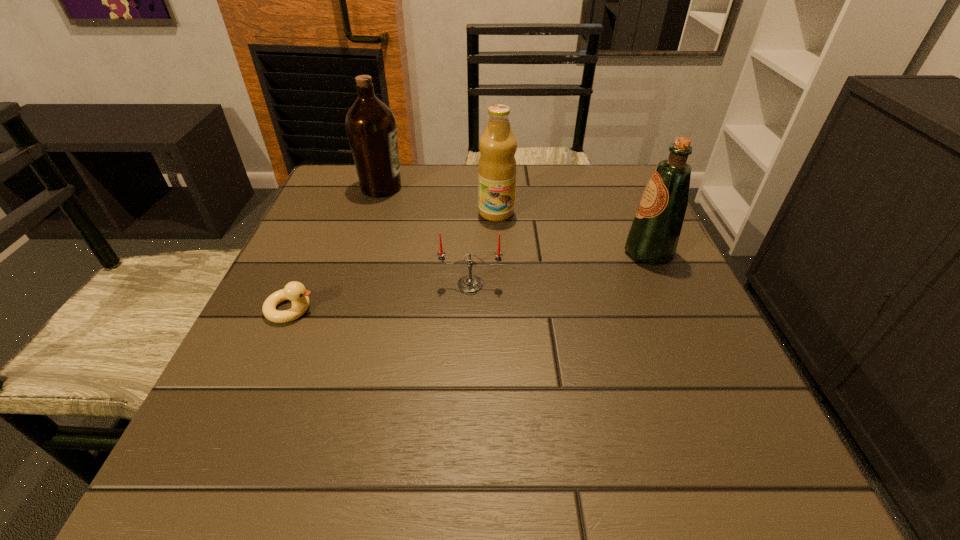
Where is `vacant point located between the leftmost olive oil and the nearest object`? vacant point located between the leftmost olive oil and the nearest object is located at coordinates (336, 248).

Identify the location of free space between the fourth farthest object and the farthest object. The height and width of the screenshot is (540, 960). (426, 236).

Find the location of a particular element. This screenshot has width=960, height=540. free space between the nearest object and the second olive oil from right to left is located at coordinates (394, 261).

The height and width of the screenshot is (540, 960). In order to click on free space between the farthest olive oil and the second farthest object in this screenshot , I will do `click(439, 200)`.

The image size is (960, 540). Find the location of `empty location between the leftmost olive oil and the second olive oil from left to right`. empty location between the leftmost olive oil and the second olive oil from left to right is located at coordinates (439, 200).

Identify which object is the fourth nearest to the duckling. Please provide its 2D coordinates. Your answer should be formatted as a tuple, i.e. [(x, y)], where the tuple contains the x and y coordinates of a point satisfying the conditions above.

[(654, 234)]

Locate an element on the screen. The image size is (960, 540). object that stands as the second closest to the second olive oil from left to right is located at coordinates 371,127.

The image size is (960, 540). I want to click on olive oil identified as the closest to the farthest olive oil, so click(x=497, y=167).

Locate which olive oil is the third closest to the fourth farthest object. Please provide its 2D coordinates. Your answer should be formatted as a tuple, i.e. [(x, y)], where the tuple contains the x and y coordinates of a point satisfying the conditions above.

[(371, 127)]